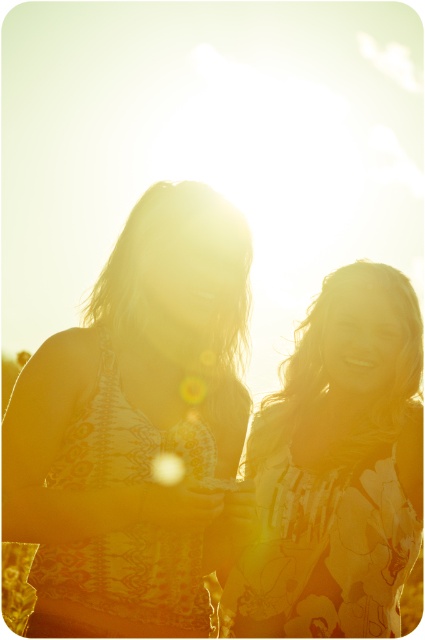
Question: Among these objects, which one is nearest to the camera?

Choices:
 (A) floral-patterned dress at right
 (B) matte yellow dress at left

Answer: (B)

Question: Which of the following is the closest to the observer?

Choices:
 (A) coord(102,531)
 (B) coord(303,476)

Answer: (A)

Question: Is matte yellow dress at left smaller than floral-patterned dress at right?

Choices:
 (A) yes
 (B) no

Answer: (B)

Question: Is matte yellow dress at left further to camera compared to floral-patterned dress at right?

Choices:
 (A) yes
 (B) no

Answer: (B)

Question: Considering the relative positions of matte yellow dress at left and floral-patterned dress at right in the image provided, where is matte yellow dress at left located with respect to floral-patterned dress at right?

Choices:
 (A) above
 (B) below

Answer: (A)

Question: Which point is farther from the camera taking this photo?

Choices:
 (A) (124, 465)
 (B) (405, 554)

Answer: (B)